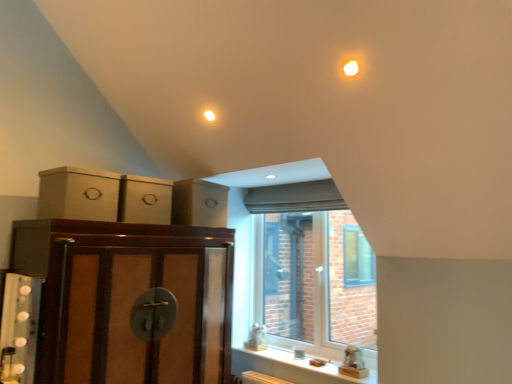
Describe the element at coordinates (199, 203) in the screenshot. I see `matte cardboard drawer at upper left` at that location.

Describe the element at coordinates (78, 194) in the screenshot. The height and width of the screenshot is (384, 512). I see `matte cardboard box at upper left, which is the first cabinetry in top-to-bottom order` at that location.

This screenshot has width=512, height=384. I want to click on brown wood cabinet at left, positioned as the third cabinetry in top-to-bottom order, so click(128, 299).

Where is `brown cardboard boxes at upper left, the 2th cabinetry from the bottom`? This screenshot has width=512, height=384. brown cardboard boxes at upper left, the 2th cabinetry from the bottom is located at coordinates (145, 200).

Where is `clear glass window at center`? The width and height of the screenshot is (512, 384). clear glass window at center is located at coordinates (303, 279).

At what (x,y) coordinates should I click in order to perform the action: click on matte cardboard drawer at upper left. Please return your answer as a coordinate pair (x, y). The width and height of the screenshot is (512, 384). Looking at the image, I should click on (199, 203).

This screenshot has width=512, height=384. Identify the location of the 2nd cabinetry above the clear glass window at center (from the image's perspective). (78, 194).

Considering the relative sizes of clear glass window at center and matte cardboard box at upper left, which is the first cabinetry in top-to-bottom order, in the image provided, is clear glass window at center smaller than matte cardboard box at upper left, which is the first cabinetry in top-to-bottom order,?

Actually, clear glass window at center might be larger than matte cardboard box at upper left, which is the first cabinetry in top-to-bottom order.

Is clear glass window at center far away from matte cardboard box at upper left, placed as the third cabinetry when sorted from bottom to top?

Indeed, clear glass window at center is not near matte cardboard box at upper left, placed as the third cabinetry when sorted from bottom to top.

From the image's perspective, is brown wood cabinet at left, marked as the 1th cabinetry in a bottom-to-top arrangement, beneath brown cardboard boxes at upper left, which ranks as the second cabinetry in top-to-bottom order?

Indeed, from the image's perspective, brown wood cabinet at left, marked as the 1th cabinetry in a bottom-to-top arrangement, is shown beneath brown cardboard boxes at upper left, which ranks as the second cabinetry in top-to-bottom order.

Which is in front, point (17, 244) or point (153, 187)?

The point (17, 244) is more forward.

Is brown wood cabinet at left, marked as the 1th cabinetry in a bottom-to-top arrangement, oriented towards brown cardboard boxes at upper left, the 2th cabinetry from the bottom?

No, brown wood cabinet at left, marked as the 1th cabinetry in a bottom-to-top arrangement, is not aimed at brown cardboard boxes at upper left, the 2th cabinetry from the bottom.

What's the angular difference between brown wood cabinet at left, marked as the 1th cabinetry in a bottom-to-top arrangement, and brown cardboard boxes at upper left, which ranks as the second cabinetry in top-to-bottom order,'s facing directions?

0.091 degrees.

From the image's perspective, which one is positioned lower, matte cardboard box at upper left, placed as the third cabinetry when sorted from bottom to top, or brown wood cabinet at left, marked as the 1th cabinetry in a bottom-to-top arrangement?

brown wood cabinet at left, marked as the 1th cabinetry in a bottom-to-top arrangement.

Looking at this image, is matte cardboard box at upper left, placed as the third cabinetry when sorted from bottom to top, with brown wood cabinet at left, marked as the 1th cabinetry in a bottom-to-top arrangement?

matte cardboard box at upper left, placed as the third cabinetry when sorted from bottom to top, and brown wood cabinet at left, marked as the 1th cabinetry in a bottom-to-top arrangement, are not in contact.

Can you confirm if matte cardboard box at upper left, placed as the third cabinetry when sorted from bottom to top, is smaller than brown wood cabinet at left, positioned as the third cabinetry in top-to-bottom order?

Yes, matte cardboard box at upper left, placed as the third cabinetry when sorted from bottom to top, is smaller than brown wood cabinet at left, positioned as the third cabinetry in top-to-bottom order.

Looking at the image, does matte cardboard drawer at upper left seem bigger or smaller compared to clear glass window at center?

In the image, matte cardboard drawer at upper left appears to be smaller than clear glass window at center.

Visually, is matte cardboard drawer at upper left positioned to the left or to the right of clear glass window at center?

matte cardboard drawer at upper left is to the left of clear glass window at center.

From a real-world perspective, is matte cardboard drawer at upper left beneath clear glass window at center?

No, from a real-world perspective, matte cardboard drawer at upper left is not under clear glass window at center.

Is matte cardboard drawer at upper left positioned far away from clear glass window at center?

Indeed, matte cardboard drawer at upper left is not near clear glass window at center.

Choose the correct answer: Is matte cardboard box at upper left, placed as the third cabinetry when sorted from bottom to top, inside brown cardboard boxes at upper left, the 2th cabinetry from the bottom, or outside it?

matte cardboard box at upper left, placed as the third cabinetry when sorted from bottom to top, exists outside the volume of brown cardboard boxes at upper left, the 2th cabinetry from the bottom.

Considering the sizes of matte cardboard box at upper left, placed as the third cabinetry when sorted from bottom to top, and brown cardboard boxes at upper left, the 2th cabinetry from the bottom, in the image, is matte cardboard box at upper left, placed as the third cabinetry when sorted from bottom to top, wider or thinner than brown cardboard boxes at upper left, the 2th cabinetry from the bottom,?

Clearly, matte cardboard box at upper left, placed as the third cabinetry when sorted from bottom to top, has less width compared to brown cardboard boxes at upper left, the 2th cabinetry from the bottom.

Based on the photo, is matte cardboard box at upper left, placed as the third cabinetry when sorted from bottom to top, in front of or behind brown cardboard boxes at upper left, the 2th cabinetry from the bottom, in the image?

In the image, matte cardboard box at upper left, placed as the third cabinetry when sorted from bottom to top, appears in front of brown cardboard boxes at upper left, the 2th cabinetry from the bottom.

Looking at this image, is matte cardboard box at upper left, placed as the third cabinetry when sorted from bottom to top, facing towards brown cardboard boxes at upper left, which ranks as the second cabinetry in top-to-bottom order?

No.

Is point (129, 222) in front of point (103, 296)?

No, (129, 222) is further to viewer.

Find the location of `the 2nd cabinetry above the brown wood cabinet at left, marked as the 1th cabinetry in a bottom-to-top arrangement (from a real-world perspective)`. the 2nd cabinetry above the brown wood cabinet at left, marked as the 1th cabinetry in a bottom-to-top arrangement (from a real-world perspective) is located at coordinates (145, 200).

From the image's perspective, is brown cardboard boxes at upper left, which ranks as the second cabinetry in top-to-bottom order, located beneath brown wood cabinet at left, positioned as the third cabinetry in top-to-bottom order?

Actually, brown cardboard boxes at upper left, which ranks as the second cabinetry in top-to-bottom order, appears above brown wood cabinet at left, positioned as the third cabinetry in top-to-bottom order, in the image.

Which is behind, brown cardboard boxes at upper left, the 2th cabinetry from the bottom, or brown wood cabinet at left, marked as the 1th cabinetry in a bottom-to-top arrangement?

brown cardboard boxes at upper left, the 2th cabinetry from the bottom, is further away from the camera.

Could you measure the distance between matte cardboard box at upper left, placed as the third cabinetry when sorted from bottom to top, and clear glass window at center?

They are 6.12 feet apart.

From a real-world perspective, which object rests below the other?

clear glass window at center.

Which of these two, matte cardboard box at upper left, placed as the third cabinetry when sorted from bottom to top, or clear glass window at center, is bigger?

With larger size is clear glass window at center.

Is matte cardboard box at upper left, which is the first cabinetry in top-to-bottom order, oriented away from clear glass window at center?

matte cardboard box at upper left, which is the first cabinetry in top-to-bottom order, is not turned away from clear glass window at center.

Identify the location of the 2nd cabinetry in front of the clear glass window at center. (78, 194).

From a real-world perspective, count 2nd cabinetrys upward from the brown wood cabinet at left, positioned as the third cabinetry in top-to-bottom order, and point to it. Please provide its 2D coordinates.

[(145, 200)]

Looking at the image, which one is located closer to matte cardboard drawer at upper left, matte cardboard box at upper left, which is the first cabinetry in top-to-bottom order, or brown cardboard boxes at upper left, the 2th cabinetry from the bottom?

The object closer to matte cardboard drawer at upper left is brown cardboard boxes at upper left, the 2th cabinetry from the bottom.

Based on the photo, based on their spatial positions, is brown cardboard boxes at upper left, which ranks as the second cabinetry in top-to-bottom order, or matte cardboard drawer at upper left closer to matte cardboard box at upper left, which is the first cabinetry in top-to-bottom order?

brown cardboard boxes at upper left, which ranks as the second cabinetry in top-to-bottom order.

Which object lies nearer to the anchor point matte cardboard box at upper left, placed as the third cabinetry when sorted from bottom to top, brown wood cabinet at left, positioned as the third cabinetry in top-to-bottom order, or matte cardboard drawer at upper left?

brown wood cabinet at left, positioned as the third cabinetry in top-to-bottom order, is positioned closer to the anchor matte cardboard box at upper left, placed as the third cabinetry when sorted from bottom to top.

Estimate the real-world distances between objects in this image. Which object is closer to brown wood cabinet at left, marked as the 1th cabinetry in a bottom-to-top arrangement, clear glass window at center or matte cardboard drawer at upper left?

Based on the image, matte cardboard drawer at upper left appears to be nearer to brown wood cabinet at left, marked as the 1th cabinetry in a bottom-to-top arrangement.

Which object lies further to the anchor point brown cardboard boxes at upper left, the 2th cabinetry from the bottom, clear glass window at center or matte cardboard drawer at upper left?

The object further to brown cardboard boxes at upper left, the 2th cabinetry from the bottom, is clear glass window at center.

When comparing their distances from matte cardboard box at upper left, placed as the third cabinetry when sorted from bottom to top, does clear glass window at center or brown wood cabinet at left, positioned as the third cabinetry in top-to-bottom order, seem further?

clear glass window at center lies further to matte cardboard box at upper left, placed as the third cabinetry when sorted from bottom to top, than the other object.

Based on their spatial positions, is brown wood cabinet at left, marked as the 1th cabinetry in a bottom-to-top arrangement, or clear glass window at center further from matte cardboard drawer at upper left?

clear glass window at center is further to matte cardboard drawer at upper left.

Based on their spatial positions, is matte cardboard drawer at upper left or clear glass window at center closer to brown wood cabinet at left, marked as the 1th cabinetry in a bottom-to-top arrangement?

A: Based on the image, matte cardboard drawer at upper left appears to be nearer to brown wood cabinet at left, marked as the 1th cabinetry in a bottom-to-top arrangement.

The width and height of the screenshot is (512, 384). What are the coordinates of `cabinetry that lies between matte cardboard box at upper left, which is the first cabinetry in top-to-bottom order, and brown wood cabinet at left, marked as the 1th cabinetry in a bottom-to-top arrangement, from top to bottom` in the screenshot? It's located at (145, 200).

In order to click on drawer between matte cardboard box at upper left, placed as the third cabinetry when sorted from bottom to top, and brown wood cabinet at left, positioned as the third cabinetry in top-to-bottom order, from top to bottom in this screenshot , I will do `click(199, 203)`.

What are the coordinates of `drawer between matte cardboard box at upper left, which is the first cabinetry in top-to-bottom order, and clear glass window at center` in the screenshot? It's located at (199, 203).

Image resolution: width=512 pixels, height=384 pixels. I want to click on drawer located between brown cardboard boxes at upper left, the 2th cabinetry from the bottom, and clear glass window at center in the left-right direction, so click(x=199, y=203).